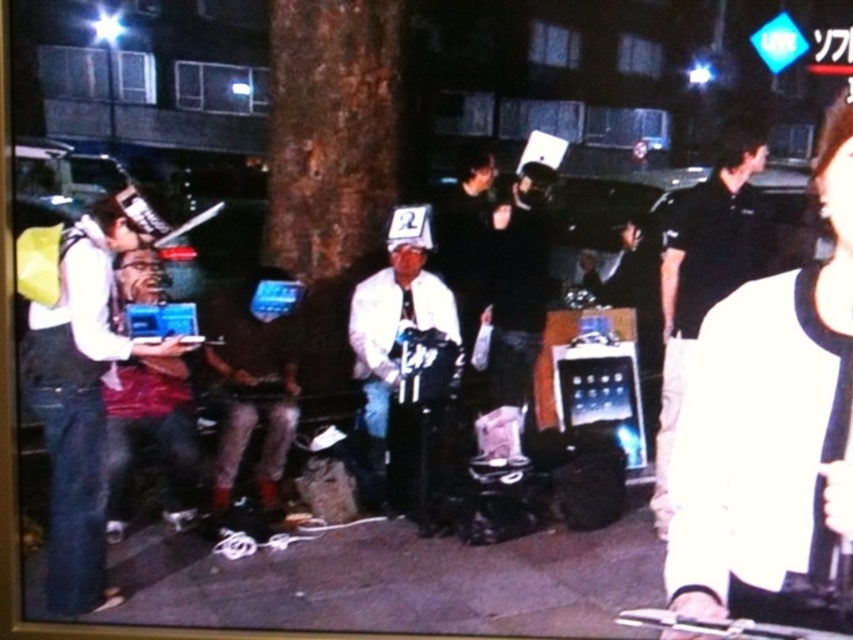
You are a photographer standing in the scene. You want to take a photo of the white matte laptop at center without the black smooth shirt at right blocking it. Is the laptop visible from your current position?

The black smooth shirt at right is taller than the white matte laptop at center, so the shirt may block the view of the laptop depending on the angle and distance. To ensure visibility, move closer or adjust your angle to avoid the obstruction.

You are a photographer trying to capture a photo of the metallic silver laptop at center and the black smooth shirt at right. To ensure both are in frame, should you adjust your camera to the left or to the right?

The black smooth shirt at right is to the right of the metallic silver laptop at center, so you should adjust your camera to the left to include both in the frame.